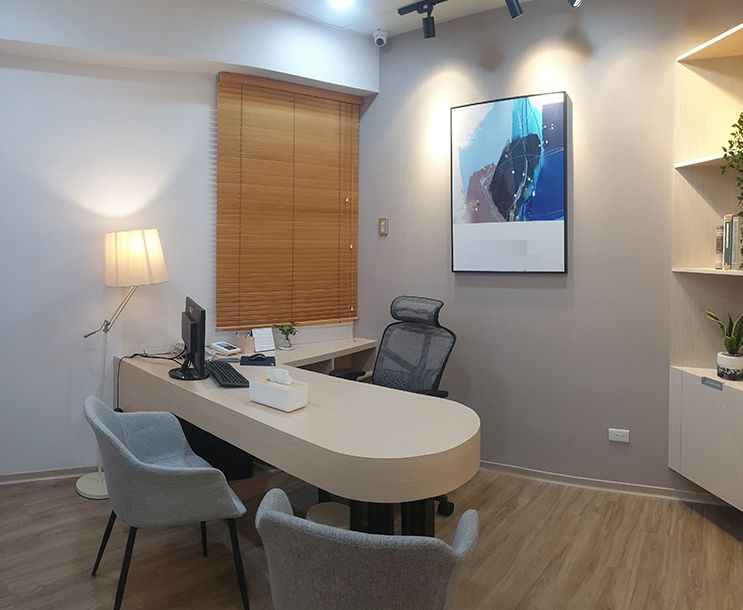
This screenshot has width=743, height=610. I want to click on computer monitor, so 197,337.